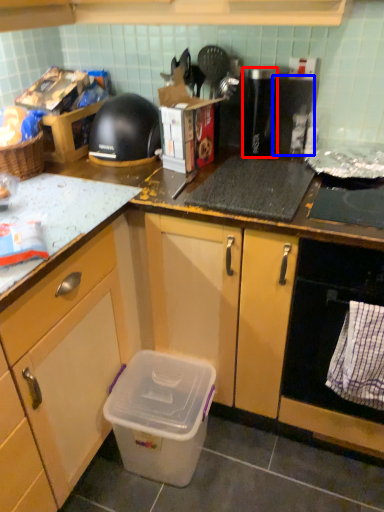
Question: Among these objects, which one is farthest to the camera, appliance (highlighted by a red box) or appliance (highlighted by a blue box)?

Choices:
 (A) appliance
 (B) appliance

Answer: (B)